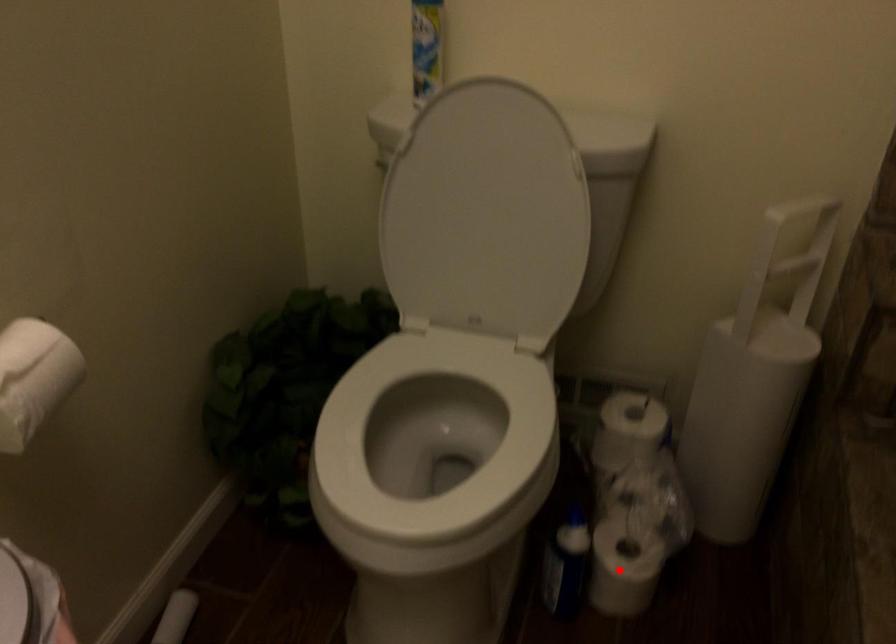
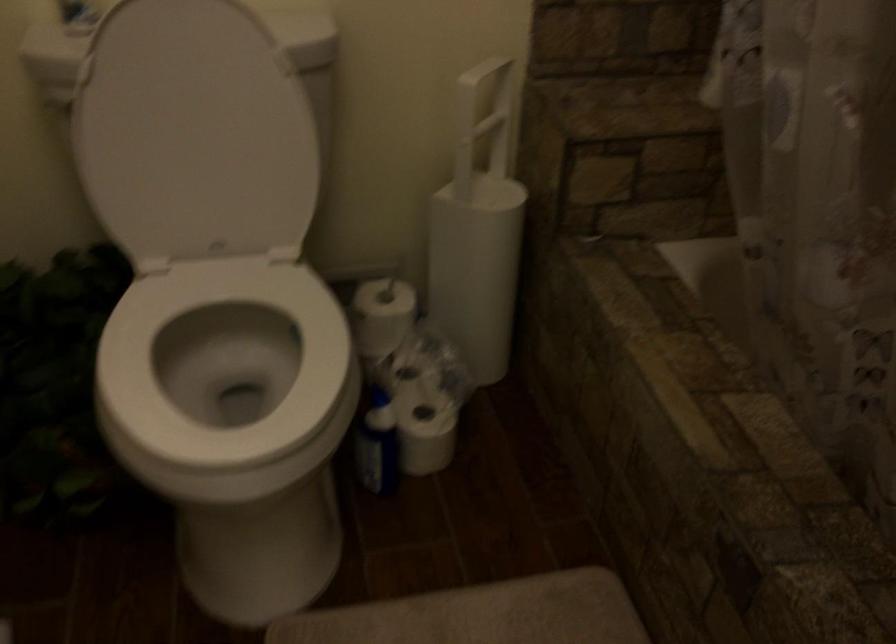
Where in the second image is the point corresponding to the highlighted location from the first image?

(426, 436)